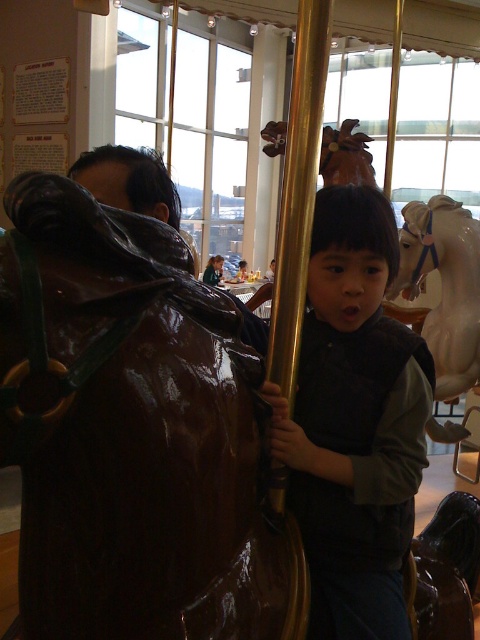
Question: Which object appears farthest from the camera in this image?

Choices:
 (A) glossy brown horse at left
 (B) matte black vest at center
 (C) white glossy horse at center

Answer: (C)

Question: Where is glossy brown horse at left located in relation to matte black vest at center in the image?

Choices:
 (A) above
 (B) below

Answer: (B)

Question: Among these points, which one is farthest from the camera?

Choices:
 (A) (408, 248)
 (B) (327, 339)

Answer: (A)

Question: Is glossy brown horse at left to the left of matte black vest at center from the viewer's perspective?

Choices:
 (A) no
 (B) yes

Answer: (B)

Question: From the image, what is the correct spatial relationship of glossy brown horse at left in relation to white glossy horse at center?

Choices:
 (A) above
 (B) below

Answer: (B)

Question: Which of the following is the farthest from the observer?

Choices:
 (A) glossy brown horse at left
 (B) matte black vest at center
 (C) white glossy horse at center

Answer: (C)